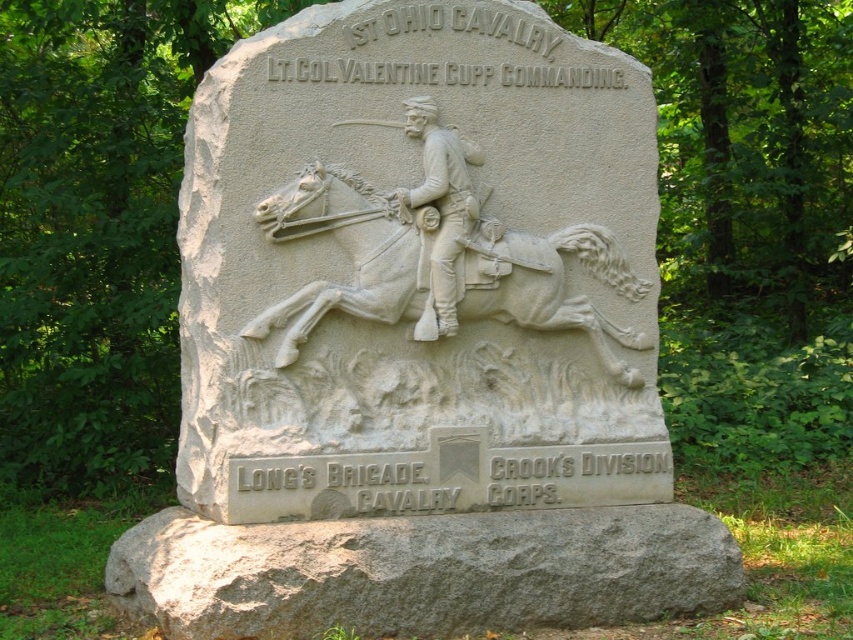
Question: Which of the following is the closest to the observer?

Choices:
 (A) pyautogui.click(x=358, y=248)
 (B) pyautogui.click(x=451, y=310)

Answer: (A)

Question: Which of the following is the closest to the observer?

Choices:
 (A) white stone soldier at center
 (B) white stone horse at center
 (C) gray stone base at lower center

Answer: (C)

Question: Does white stone horse at center lie in front of white stone soldier at center?

Choices:
 (A) no
 (B) yes

Answer: (B)

Question: Which point appears closest to the camera in this image?

Choices:
 (A) (262, 324)
 (B) (408, 216)
 (C) (241, 614)

Answer: (C)

Question: Does gray stone base at lower center appear on the right side of white stone horse at center?

Choices:
 (A) yes
 (B) no

Answer: (A)

Question: Is gray stone base at lower center smaller than white stone soldier at center?

Choices:
 (A) no
 (B) yes

Answer: (A)